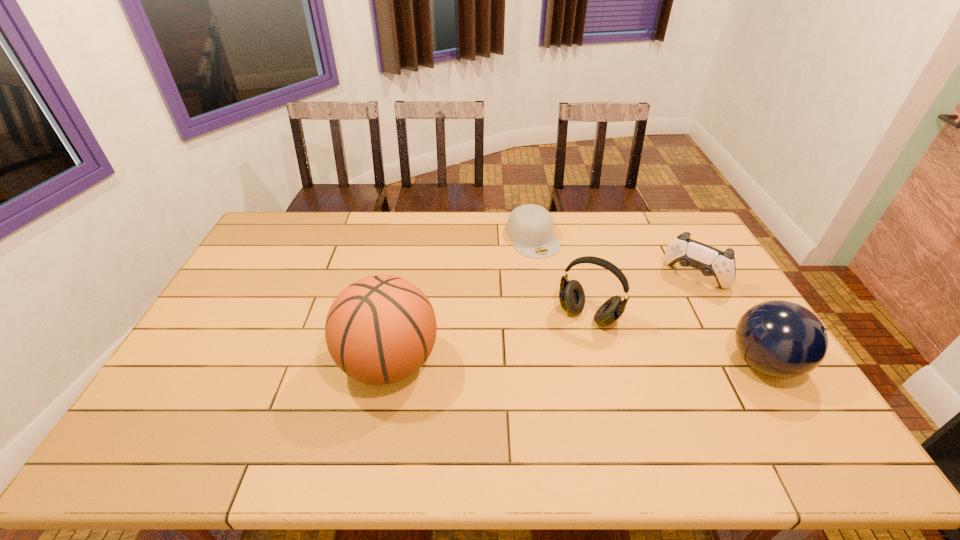
This screenshot has height=540, width=960. Find the location of `vacant space on the desktop that is between the leftmost object and the bowling ball and is positioned on the front-facing side of the shortest object`. vacant space on the desktop that is between the leftmost object and the bowling ball and is positioned on the front-facing side of the shortest object is located at coordinates (611, 363).

You are a GUI agent. You are given a task and a screenshot of the screen. Output one action in this format:
    pyautogui.click(x=<x>, y=<y>)
    Task: Click on the free space on the desktop that is between the tallest object and the bowling ball and is positioned on the front-facing side of the second shortest object
    
    Given the screenshot: What is the action you would take?
    pyautogui.click(x=631, y=363)

Find the location of a particular element. The image size is (960, 540). vacant spot on the desktop that is between the leftmost object and the bowling ball and is positioned on the ear cups of the headset is located at coordinates (561, 363).